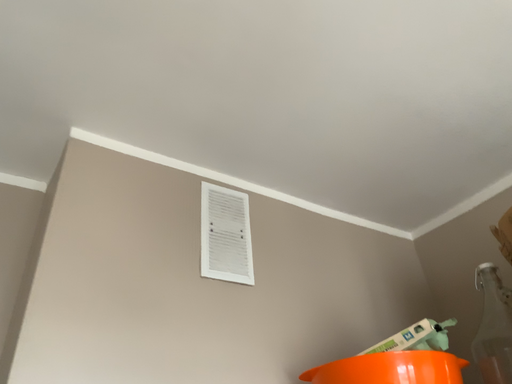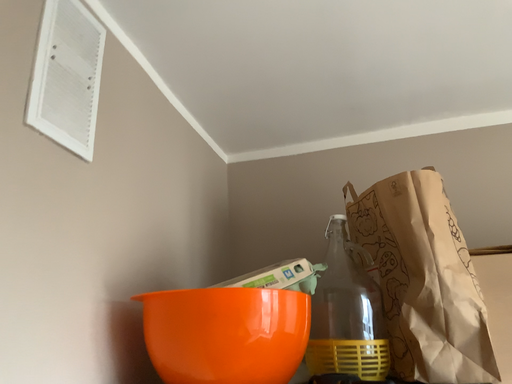
Question: How did the camera likely rotate when shooting the video?

Choices:
 (A) rotated right
 (B) rotated left

Answer: (A)